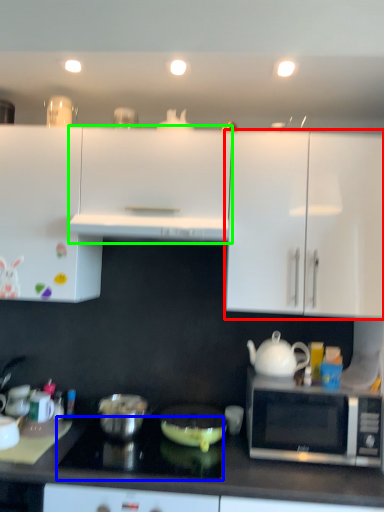
Question: Estimate the real-world distances between objects in this image. Which object is closer to cabinetry (highlighted by a red box), gas stove (highlighted by a blue box) or cabinetry (highlighted by a green box)?

Choices:
 (A) gas stove
 (B) cabinetry

Answer: (B)